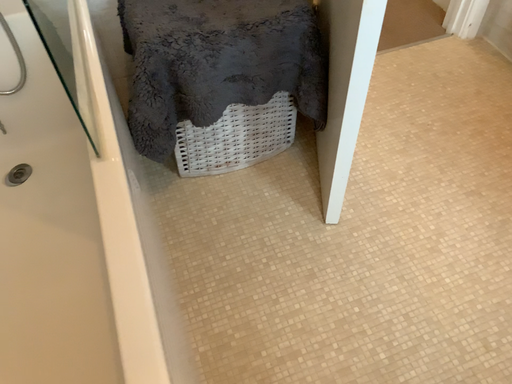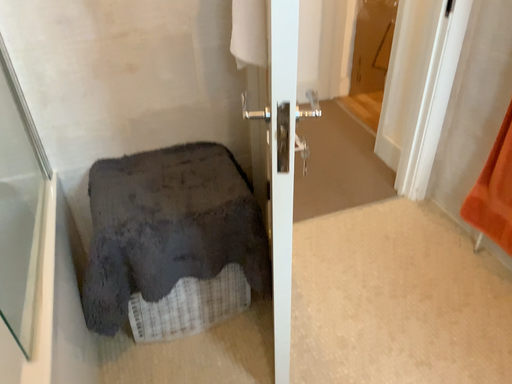
Question: How did the camera likely rotate when shooting the video?

Choices:
 (A) rotated downward
 (B) rotated upward

Answer: (B)